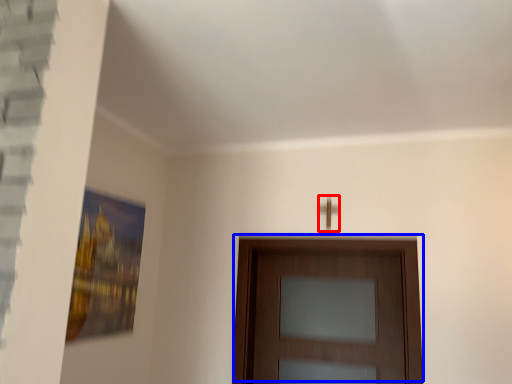
Question: Which of the following is the closest to the observer, door handle (highlighted by a red box) or door (highlighted by a blue box)?

Choices:
 (A) door handle
 (B) door

Answer: (B)